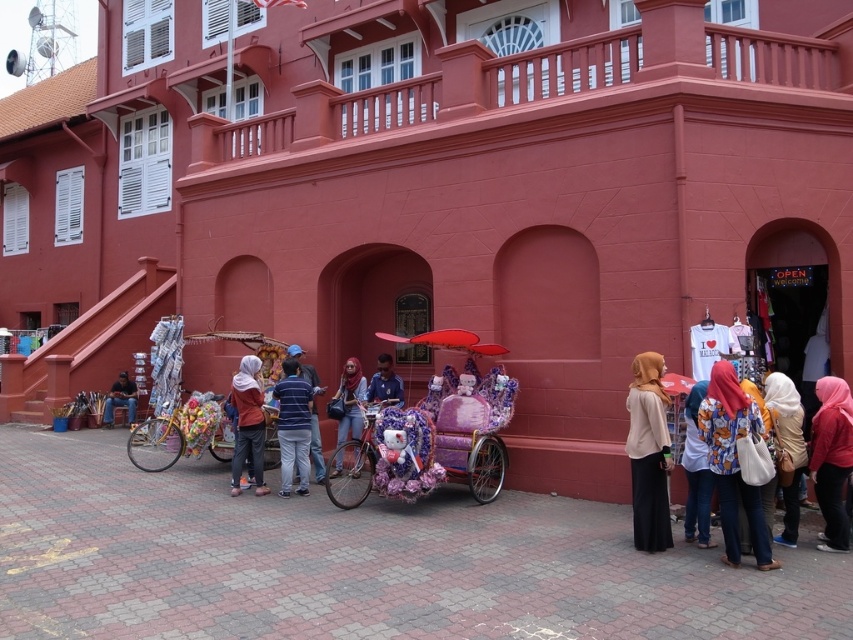
Which is more to the right, blue denim jeans at center or red matte umbrella at center?

Positioned to the right is red matte umbrella at center.

Can you confirm if blue denim jeans at center is positioned above red matte umbrella at center?

Actually, blue denim jeans at center is below red matte umbrella at center.

The width and height of the screenshot is (853, 640). I want to click on blue denim jeans at center, so click(293, 426).

Can you confirm if pink fabric headscarf at lower right is shorter than red matte umbrella at center?

No, pink fabric headscarf at lower right is not shorter than red matte umbrella at center.

Does point (822, 401) come closer to viewer compared to point (439, 339)?

Yes, point (822, 401) is in front of point (439, 339).

Describe the element at coordinates (831, 458) in the screenshot. Image resolution: width=853 pixels, height=640 pixels. I see `pink fabric headscarf at lower right` at that location.

Locate an element on the screen. This screenshot has height=640, width=853. pink fabric headscarf at lower right is located at coordinates (831, 458).

Between point (743, 435) and point (453, 348), which one is positioned in front?

Point (743, 435) is in front.

Which of these two, printed fabric headscarf at lower right or red matte umbrella at center, stands shorter?

Standing shorter between the two is red matte umbrella at center.

Is point (712, 362) positioned in front of point (430, 336)?

Yes, it is in front of point (430, 336).

I want to click on printed fabric headscarf at lower right, so click(x=733, y=461).